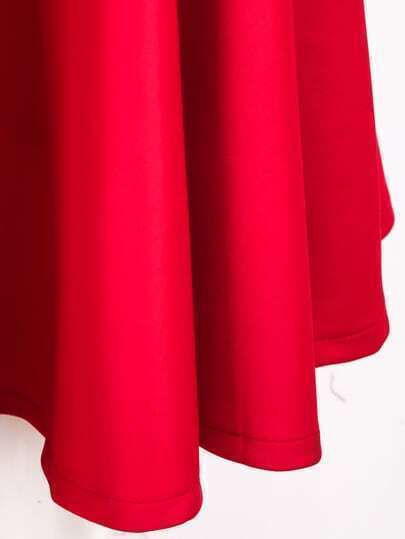
Where is `red curtain`? This screenshot has width=405, height=539. red curtain is located at coordinates (163, 432).